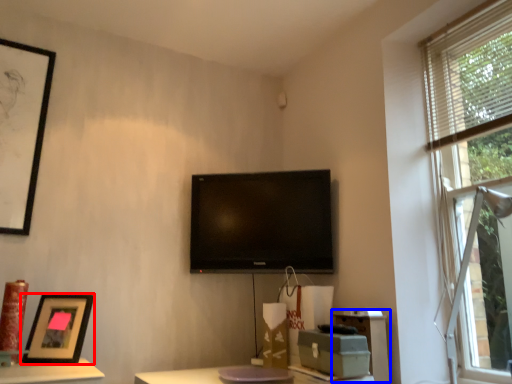
Question: Which of the following is the closest to the observer, picture frame (highlighted by a red box) or file cabinet (highlighted by a blue box)?

Choices:
 (A) picture frame
 (B) file cabinet

Answer: (A)